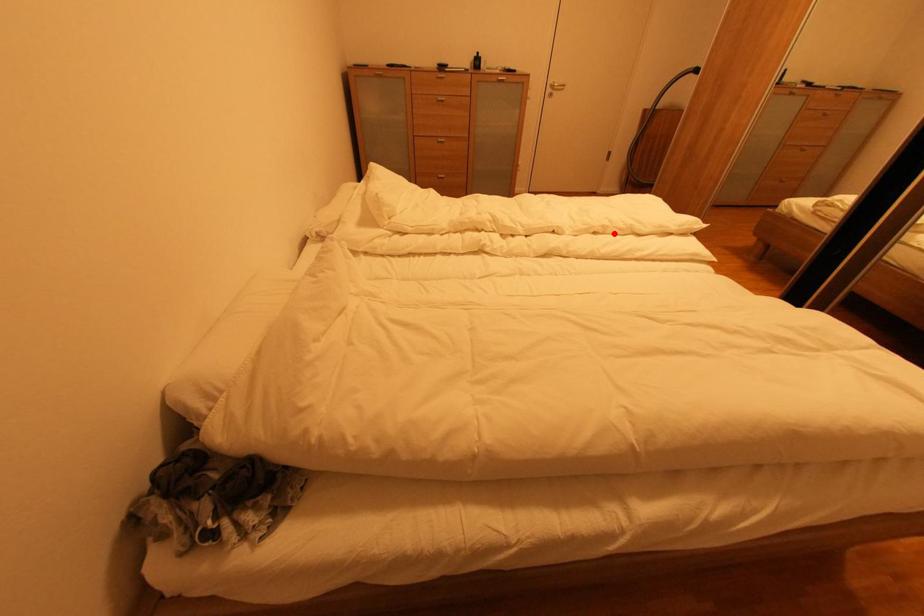
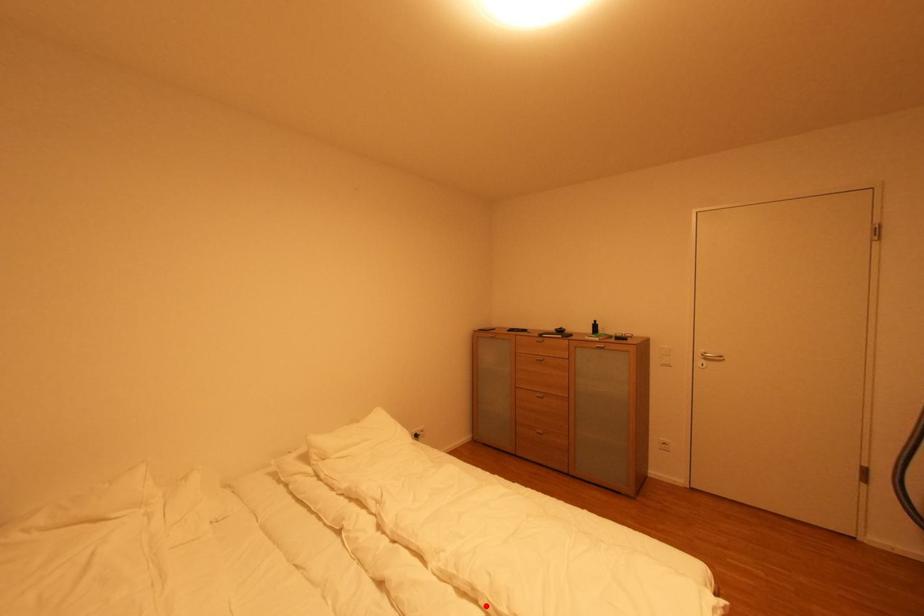
I am providing you with two images of the same scene from different viewpoints. A red point is marked on the first image and another point is marked on the second image. Do the highlighted points in image1 and image2 indicate the same real-world spot?

Yes